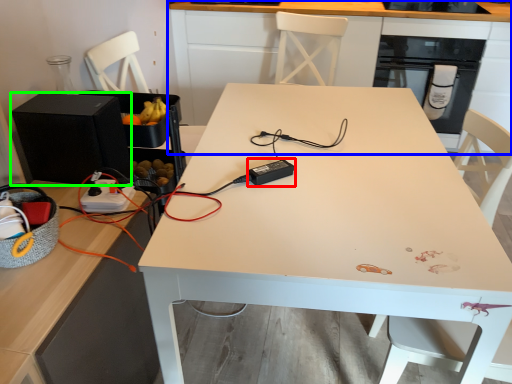
Question: Which is nearer to the appliance (highlighted by a red box)? cabinetry (highlighted by a blue box) or appliance (highlighted by a green box).

Choices:
 (A) cabinetry
 (B) appliance

Answer: (B)